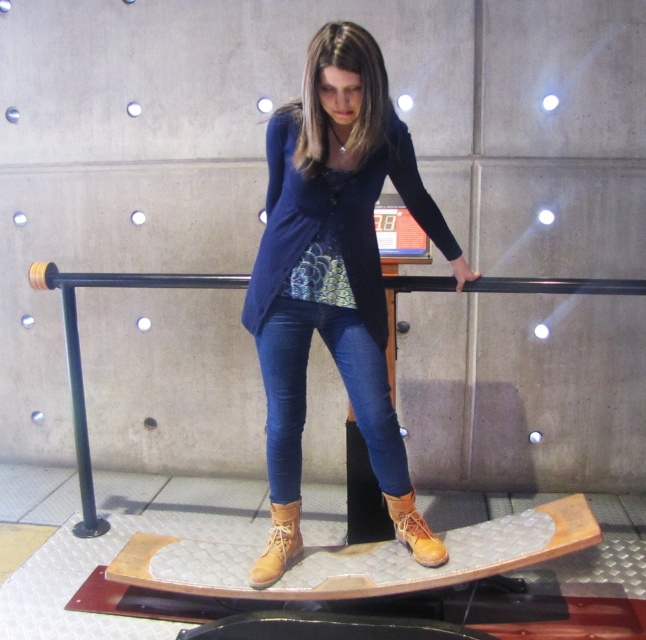
Question: Is black metal rail at center behind tan suede boot at center?

Choices:
 (A) yes
 (B) no

Answer: (A)

Question: Which point is closer to the camera taking this photo?

Choices:
 (A) (306, 332)
 (B) (78, 404)
 (C) (432, 560)
 (D) (253, 582)

Answer: (D)

Question: Does matte blue jeans at center have a lesser width compared to denim at center?

Choices:
 (A) yes
 (B) no

Answer: (B)

Question: Which of the following is the farthest from the observer?

Choices:
 (A) (289, 540)
 (B) (397, 289)

Answer: (B)

Question: Which object is closer to the camera taking this photo?

Choices:
 (A) matte blue jeans at center
 (B) black metal rail at center
 (C) tan leather boot at lower center
 (D) tan suede boot at center

Answer: (A)

Question: Is the position of denim at center less distant than that of black metal rail at center?

Choices:
 (A) yes
 (B) no

Answer: (A)